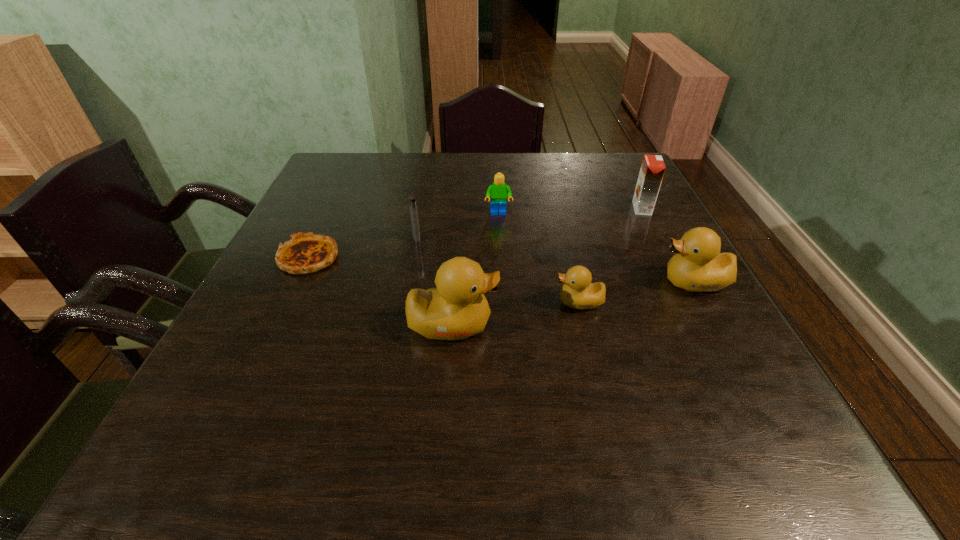
Where is `vacant space positioned 0.100m facing forward on the third object from right to left`? This screenshot has height=540, width=960. vacant space positioned 0.100m facing forward on the third object from right to left is located at coordinates (506, 302).

This screenshot has width=960, height=540. What are the coordinates of `free space located 0.070m facing forward on the third object from right to left` in the screenshot? It's located at (520, 302).

The height and width of the screenshot is (540, 960). In order to click on vacant space located 0.150m facing forward on the third object from right to left in this screenshot , I will do `click(481, 302)`.

At what (x,y) coordinates should I click in order to perform the action: click on free spot located facing forward on the rightmost duckling. Please return your answer as a coordinate pair (x, y). Looking at the image, I should click on (625, 282).

Identify the location of vacant space located 0.290m facing forward on the rightmost duckling. This screenshot has height=540, width=960. (522, 282).

The width and height of the screenshot is (960, 540). I want to click on vacant space positioned facing forward on the rightmost duckling, so click(x=569, y=282).

This screenshot has height=540, width=960. I want to click on vacant space located on the back of the shortest object, so click(344, 183).

This screenshot has height=540, width=960. What are the coordinates of `blank area located 0.360m on the face of the Lego` in the screenshot? It's located at (504, 319).

This screenshot has height=540, width=960. In order to click on blank space located 0.190m on the left of the orange juice in this screenshot , I will do `click(561, 208)`.

Locate an element on the screen. vacant space situated on the left of the igniter is located at coordinates (297, 238).